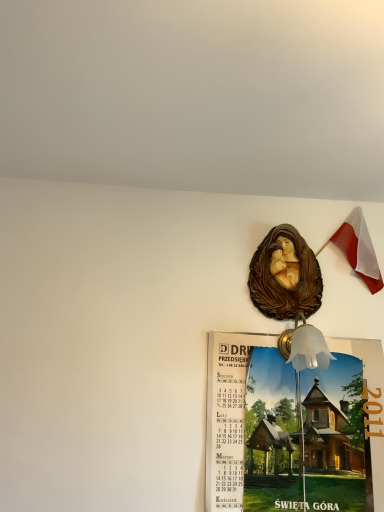
Question: Is point (377, 290) closer or farther from the camera than point (269, 270)?

Choices:
 (A) farther
 (B) closer

Answer: (A)

Question: Choose the correct answer: Is polish flag at upper right inside brown glossy statue at upper center or outside it?

Choices:
 (A) outside
 (B) inside

Answer: (A)

Question: Which is farther from the brown glossy statue at upper center?

Choices:
 (A) polish flag at upper right
 (B) wooden calendar at center

Answer: (B)

Question: Which object is the closest to the brown glossy statue at upper center?

Choices:
 (A) wooden calendar at center
 (B) polish flag at upper right

Answer: (B)